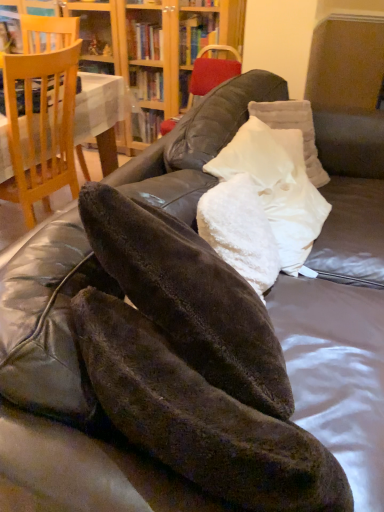
You are a GUI agent. You are given a task and a screenshot of the screen. Output one action in this format:
    pyautogui.click(x=<x>, y=<y>)
    Task: Click on the white fluffy pillow at center, the third pillow positioned from the back
    
    Given the screenshot: What is the action you would take?
    pyautogui.click(x=240, y=231)

The image size is (384, 512). Identify the location of wooden bookcase at upper center. (156, 41).

You are a GUI agent. You are given a task and a screenshot of the screen. Output one action in this format:
    pyautogui.click(x=<x>, y=<y>)
    Task: Click on the white fluffy pillow at center, the 2th pillow when ordered from back to front
    The width and height of the screenshot is (384, 512).
    Given the screenshot: What is the action you would take?
    pyautogui.click(x=277, y=186)

Considering the points (296, 112) and (168, 70), which point is in front, point (296, 112) or point (168, 70)?

The point (296, 112) is closer.

Who is taller, white fluffy pillow at center, the first pillow when ordered from back to front, or wooden bookcase at upper center?

wooden bookcase at upper center is taller.

Measure the distance between white fluffy pillow at center, the first pillow when ordered from back to front, and wooden bookcase at upper center.

white fluffy pillow at center, the first pillow when ordered from back to front, and wooden bookcase at upper center are 1.30 meters apart.

From a real-world perspective, relative to white fluffy pillow at center, acting as the 3th pillow starting from the front, is light brown wooden chair at left vertically above or below?

Clearly, from a real-world perspective, light brown wooden chair at left is below white fluffy pillow at center, acting as the 3th pillow starting from the front.

The height and width of the screenshot is (512, 384). Identify the location of chair located in front of the white fluffy pillow at center, the first pillow when ordered from back to front. (41, 129).

Based on the photo, could you measure the distance between light brown wooden chair at left and white fluffy pillow at center, acting as the 3th pillow starting from the front?

A distance of 37.58 inches exists between light brown wooden chair at left and white fluffy pillow at center, acting as the 3th pillow starting from the front.

Is light brown wooden chair at left taller than white fluffy pillow at center, the first pillow when ordered from back to front?

Yes, light brown wooden chair at left is taller than white fluffy pillow at center, the first pillow when ordered from back to front.

In terms of height, does white fluffy pillow at center, which is the second pillow from front to back, look taller or shorter compared to light brown wooden chair at left?

Considering their sizes, white fluffy pillow at center, which is the second pillow from front to back, has less height than light brown wooden chair at left.

From a real-world perspective, is white fluffy pillow at center, the 2th pillow when ordered from back to front, under light brown wooden chair at left?

Incorrect, from a real-world perspective, white fluffy pillow at center, the 2th pillow when ordered from back to front, is higher than light brown wooden chair at left.

Which object is further away from the camera taking this photo, white fluffy pillow at center, the 2th pillow when ordered from back to front, or light brown wooden chair at left?

Positioned behind is light brown wooden chair at left.

Which is closer, (326, 181) or (30, 60)?

The point (30, 60) is closer.

Is white fluffy pillow at center, the first pillow when ordered from back to front, looking in the opposite direction of light brown wooden chair at left?

No, white fluffy pillow at center, the first pillow when ordered from back to front, is not facing the opposite direction of light brown wooden chair at left.

From the image's perspective, is white fluffy pillow at center, the first pillow when ordered from back to front, located above or below light brown wooden chair at left?

white fluffy pillow at center, the first pillow when ordered from back to front, is situated lower than light brown wooden chair at left in the image.

Does white fluffy pillow at center, the first pillow when ordered from back to front, contain light brown wooden chair at left?

That's incorrect, light brown wooden chair at left is not inside white fluffy pillow at center, the first pillow when ordered from back to front.

Is white fluffy pillow at center, the 2th pillow when ordered from back to front, at the back of white fluffy pillow at center, acting as the 3th pillow starting from the front?

No, white fluffy pillow at center, acting as the 3th pillow starting from the front,'s orientation is not away from white fluffy pillow at center, the 2th pillow when ordered from back to front.

Where is `pillow behind the white fluffy pillow at center, the 2th pillow when ordered from back to front`? The height and width of the screenshot is (512, 384). pillow behind the white fluffy pillow at center, the 2th pillow when ordered from back to front is located at coordinates (294, 128).

Is white fluffy pillow at center, acting as the 3th pillow starting from the front, far from white fluffy pillow at center, the 2th pillow when ordered from back to front?

No, there isn't a large distance between white fluffy pillow at center, acting as the 3th pillow starting from the front, and white fluffy pillow at center, the 2th pillow when ordered from back to front.

Is white fluffy pillow at center, acting as the 3th pillow starting from the front, not within white fluffy pillow at center, the 2th pillow when ordered from back to front?

Yes.

Is white fluffy pillow at center, acting as the 3th pillow starting from the front, surrounding white fluffy pillow at center, marked as the first pillow in a front-to-back arrangement?

That's incorrect, white fluffy pillow at center, marked as the first pillow in a front-to-back arrangement, is not inside white fluffy pillow at center, acting as the 3th pillow starting from the front.

How many degrees apart are the facing directions of white fluffy pillow at center, acting as the 3th pillow starting from the front, and white fluffy pillow at center, the third pillow positioned from the back?

They differ by 33.5 degrees in their facing directions.

From the image's perspective, is white fluffy pillow at center, acting as the 3th pillow starting from the front, positioned above or below white fluffy pillow at center, marked as the first pillow in a front-to-back arrangement?

Clearly, from the image's perspective, white fluffy pillow at center, acting as the 3th pillow starting from the front, is above white fluffy pillow at center, marked as the first pillow in a front-to-back arrangement.

From a real-world perspective, is white fluffy pillow at center, acting as the 3th pillow starting from the front, physically located above or below white fluffy pillow at center, the third pillow positioned from the back?

From a real-world perspective, white fluffy pillow at center, acting as the 3th pillow starting from the front, is physically below white fluffy pillow at center, the third pillow positioned from the back.

Is white fluffy pillow at center, which is the second pillow from front to back, positioned with its back to white fluffy pillow at center, acting as the 3th pillow starting from the front?

No, white fluffy pillow at center, which is the second pillow from front to back, is not facing away from white fluffy pillow at center, acting as the 3th pillow starting from the front.

Looking at this image, who is shorter, white fluffy pillow at center, the 2th pillow when ordered from back to front, or white fluffy pillow at center, the first pillow when ordered from back to front?

white fluffy pillow at center, the first pillow when ordered from back to front.

In order to click on pillow that is the 2nd one below the white fluffy pillow at center, the 2th pillow when ordered from back to front (from a real-world perspective) in this screenshot , I will do `click(294, 128)`.

Locate an element on the screen. bookcase above the white fluffy pillow at center, acting as the 3th pillow starting from the front (from the image's perspective) is located at coordinates click(156, 41).

Identify the location of chair on the left of the white fluffy pillow at center, the first pillow when ordered from back to front. Image resolution: width=384 pixels, height=512 pixels. (41, 129).

Based on their spatial positions, is white fluffy pillow at center, the first pillow when ordered from back to front, or light brown wooden chair at left further from white fluffy pillow at center, the third pillow positioned from the back?

Among the two, light brown wooden chair at left is located further to white fluffy pillow at center, the third pillow positioned from the back.

When comparing their distances from light brown wooden chair at left, does wooden bookcase at upper center or white fluffy pillow at center, which is the second pillow from front to back, seem further?

wooden bookcase at upper center.

Which object lies nearer to the anchor point white fluffy pillow at center, acting as the 3th pillow starting from the front, white fluffy pillow at center, the 2th pillow when ordered from back to front, or white fluffy pillow at center, the third pillow positioned from the back?

Among the two, white fluffy pillow at center, the 2th pillow when ordered from back to front, is located nearer to white fluffy pillow at center, acting as the 3th pillow starting from the front.

When comparing their distances from wooden bookcase at upper center, does white fluffy pillow at center, which is the second pillow from front to back, or white fluffy pillow at center, the first pillow when ordered from back to front, seem further?

white fluffy pillow at center, which is the second pillow from front to back, lies further to wooden bookcase at upper center than the other object.

Looking at this image, looking at the image, which one is located closer to wooden bookcase at upper center, white fluffy pillow at center, the 2th pillow when ordered from back to front, or white fluffy pillow at center, the third pillow positioned from the back?

Based on the image, white fluffy pillow at center, the 2th pillow when ordered from back to front, appears to be nearer to wooden bookcase at upper center.

Which object lies further to the anchor point white fluffy pillow at center, the first pillow when ordered from back to front, white fluffy pillow at center, the third pillow positioned from the back, or wooden bookcase at upper center?

The object further to white fluffy pillow at center, the first pillow when ordered from back to front, is wooden bookcase at upper center.

Based on their spatial positions, is white fluffy pillow at center, the first pillow when ordered from back to front, or light brown wooden chair at left closer to wooden bookcase at upper center?

light brown wooden chair at left is positioned closer to the anchor wooden bookcase at upper center.

Based on their spatial positions, is wooden bookcase at upper center or white fluffy pillow at center, acting as the 3th pillow starting from the front, closer to light brown wooden chair at left?

white fluffy pillow at center, acting as the 3th pillow starting from the front.

Locate an element on the screen. The height and width of the screenshot is (512, 384). bookcase between light brown wooden chair at left and white fluffy pillow at center, acting as the 3th pillow starting from the front, in the horizontal direction is located at coordinates (156, 41).

The image size is (384, 512). I want to click on chair between white fluffy pillow at center, the 2th pillow when ordered from back to front, and wooden bookcase at upper center, along the z-axis, so click(x=41, y=129).

I want to click on pillow positioned between white fluffy pillow at center, the 2th pillow when ordered from back to front, and wooden bookcase at upper center from near to far, so click(294, 128).

Locate an element on the screen. The height and width of the screenshot is (512, 384). chair positioned between white fluffy pillow at center, marked as the first pillow in a front-to-back arrangement, and wooden bookcase at upper center from near to far is located at coordinates (41, 129).